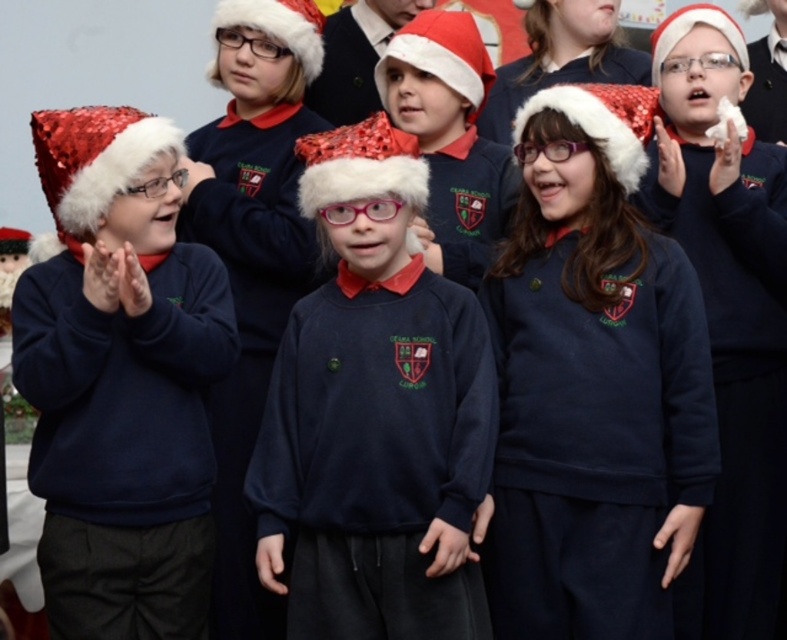
You are a photographer trying to capture a clear shot of the children in their navy blue sweatshirt at center and navy blue sweater at center. Since the sweatshirt and sweater are similar in color, how can you distinguish them in the photo?

The navy blue sweatshirt at center has a greater height compared to the navy blue sweater at center, so you can distinguish them by noting that the sweatshirt is taller than the sweater.